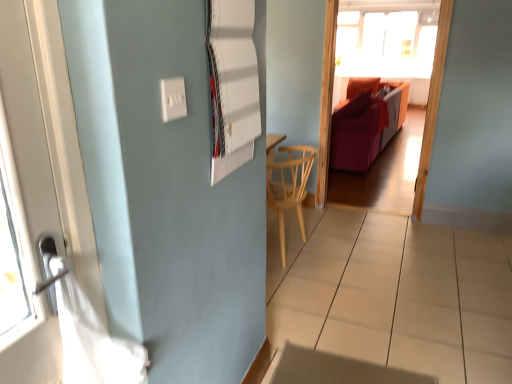
Question: From the image's perspective, is white glossy tile at lower center positioned above or below velvet orange couch at center?

Choices:
 (A) below
 (B) above

Answer: (A)

Question: Is white glossy tile at lower center in front of or behind velvet orange couch at center in the image?

Choices:
 (A) front
 (B) behind

Answer: (A)

Question: Considering the real-world distances, which object is closest to the white paperboard at upper center?

Choices:
 (A) light wood chair at center
 (B) velvet red sofa at center
 (C) velvet orange couch at center
 (D) white glossy tile at lower center
 (E) white plastic electric outlet at upper center

Answer: (E)

Question: Which is nearer to the transparent glass window at upper center?

Choices:
 (A) white glossy tile at lower center
 (B) light wood chair at center
 (C) white paperboard at upper center
 (D) white plastic electric outlet at upper center
 (E) velvet red sofa at center

Answer: (E)